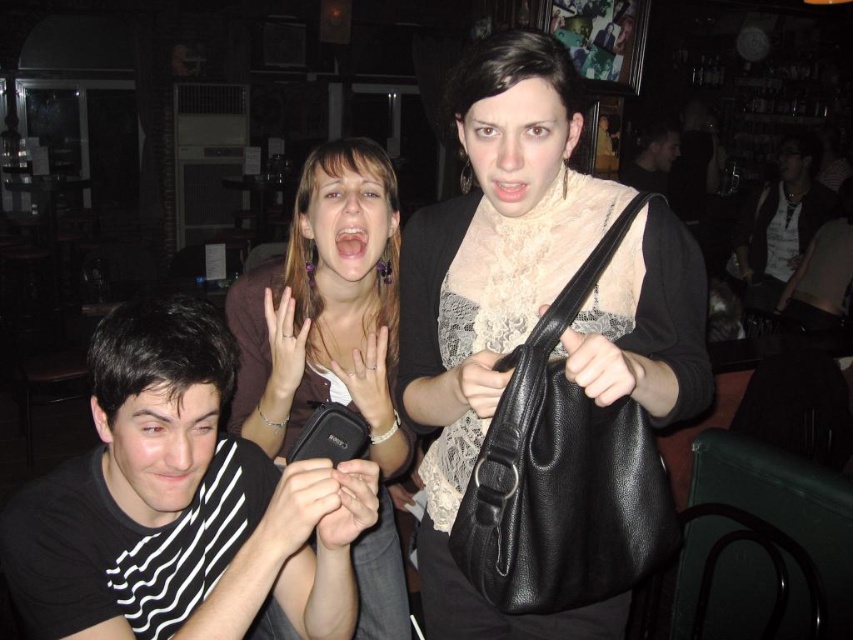
Which is more to the right, black leather handbag at center or dark brown leather jacket at right?

dark brown leather jacket at right is more to the right.

The height and width of the screenshot is (640, 853). Describe the element at coordinates (494, 298) in the screenshot. I see `black leather handbag at center` at that location.

Locate an element on the screen. Image resolution: width=853 pixels, height=640 pixels. black leather handbag at center is located at coordinates (494, 298).

Is black leather handbag at center below black striped shirt at lower left?

Incorrect, black leather handbag at center is not positioned below black striped shirt at lower left.

Describe the element at coordinates (494, 298) in the screenshot. This screenshot has height=640, width=853. I see `black leather handbag at center` at that location.

Is point (523, 300) behind point (115, 419)?

Yes, point (523, 300) is farther from viewer.

This screenshot has width=853, height=640. What are the coordinates of `black leather handbag at center` in the screenshot? It's located at (494, 298).

Between point (401, 458) and point (666, 188), which one is positioned behind?

Point (666, 188)

Between matte brown hair at center and matte black bag at upper center, which one is positioned lower?

matte brown hair at center is lower down.

At what (x,y) coordinates should I click in order to perform the action: click on matte brown hair at center. Please return your answer as a coordinate pair (x, y). The image size is (853, 640). Looking at the image, I should click on (325, 308).